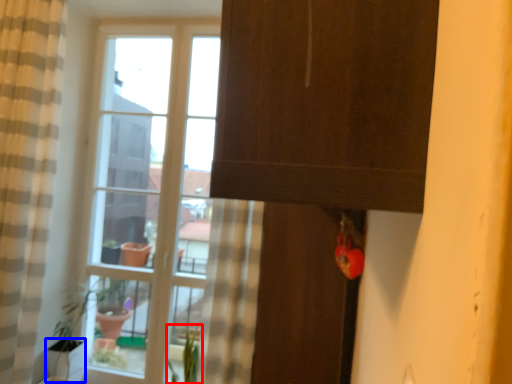
Question: Which object appears farthest to the camera in this image, plant (highlighted by a red box) or glass vase (highlighted by a blue box)?

Choices:
 (A) plant
 (B) glass vase

Answer: (B)